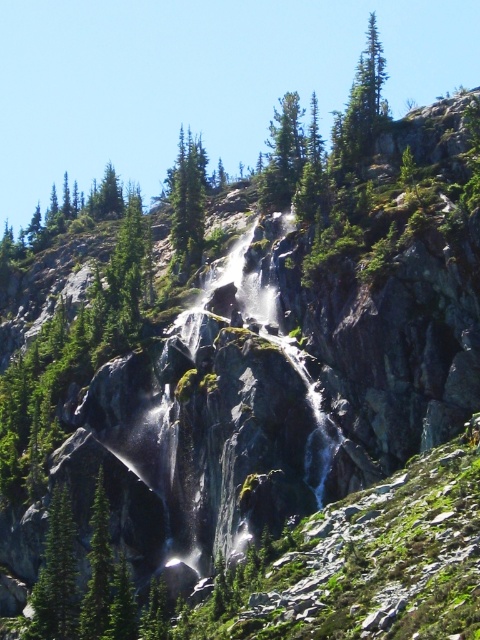
Question: Is the position of green matte tree at center-left less distant than that of green matte tree at lower left?

Choices:
 (A) yes
 (B) no

Answer: (B)

Question: Which point is farther to the camera?

Choices:
 (A) green matte tree at lower left
 (B) green matte tree at center-left

Answer: (B)

Question: Is green matte tree at center-left behind green matte tree at lower left?

Choices:
 (A) yes
 (B) no

Answer: (A)

Question: Is green matte tree at center-left smaller than green matte tree at lower left?

Choices:
 (A) no
 (B) yes

Answer: (A)